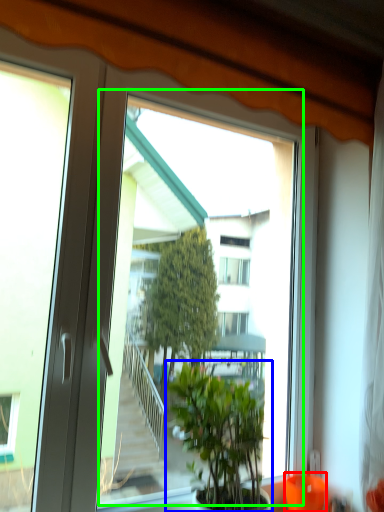
Question: Which object is the closest to the glass vase (highlighted by a red box)? Choose among these: houseplant (highlighted by a blue box) or window screen (highlighted by a green box).

Choices:
 (A) houseplant
 (B) window screen

Answer: (A)